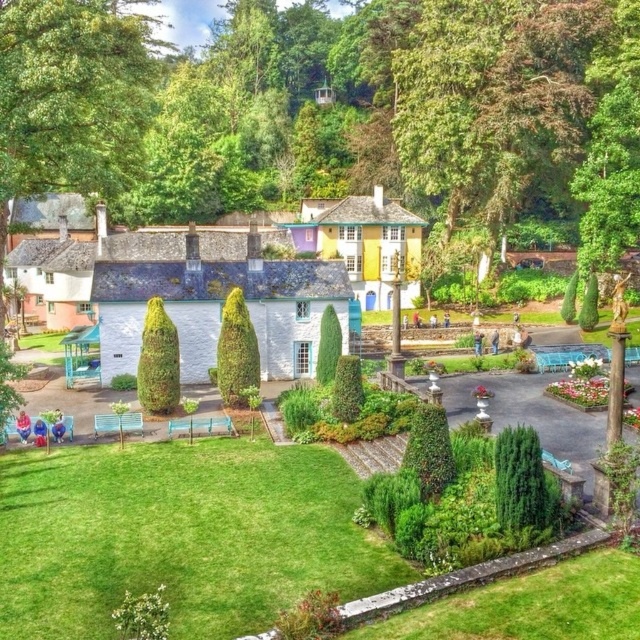
Does green grass at lower center have a greater height compared to green textured hedge at center-left?

Incorrect, green grass at lower center's height is not larger of green textured hedge at center-left's.

Which of these two, green grass at lower center or green textured hedge at center-left, stands taller?

green textured hedge at center-left

You are a GUI agent. You are given a task and a screenshot of the screen. Output one action in this format:
    pyautogui.click(x=<x>, y=<y>)
    Task: Click on the green grass at lower center
    This screenshot has height=640, width=640.
    Given the screenshot: What is the action you would take?
    pyautogui.click(x=179, y=536)

This screenshot has width=640, height=640. Find the location of `green grass at lower center`. green grass at lower center is located at coordinates (179, 536).

Identify the location of green grass at lower center. The width and height of the screenshot is (640, 640). (179, 536).

Can you confirm if green textured hedge at center-left is taller than green textured hedge at center?

No.

Between green textured hedge at center-left and green textured hedge at center, which one has less height?

green textured hedge at center-left

Between point (176, 385) and point (236, 332), which one is positioned behind?

The point (236, 332) is more distant.

This screenshot has width=640, height=640. Identify the location of green textured hedge at center-left. (157, 362).